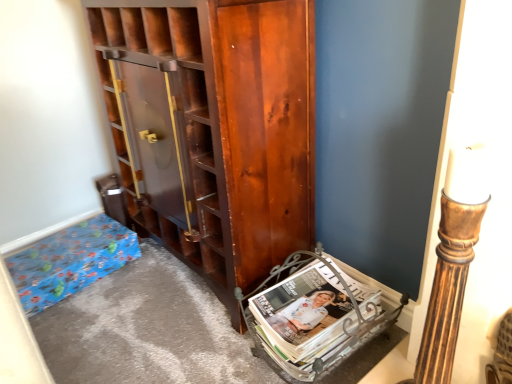
Question: Is blue paper bag at lower left taller than matte metallic magazine rack at lower right?

Choices:
 (A) no
 (B) yes

Answer: (A)

Question: From a real-world perspective, is blue paper bag at lower left physically above matte metallic magazine rack at lower right?

Choices:
 (A) yes
 (B) no

Answer: (B)

Question: Is blue paper bag at lower left wider than matte metallic magazine rack at lower right?

Choices:
 (A) no
 (B) yes

Answer: (A)

Question: Is blue paper bag at lower left far from matte metallic magazine rack at lower right?

Choices:
 (A) no
 (B) yes

Answer: (A)

Question: Can you confirm if blue paper bag at lower left is positioned to the left of matte metallic magazine rack at lower right?

Choices:
 (A) yes
 (B) no

Answer: (A)

Question: Considering the relative sizes of blue paper bag at lower left and matte metallic magazine rack at lower right in the image provided, is blue paper bag at lower left thinner than matte metallic magazine rack at lower right?

Choices:
 (A) yes
 (B) no

Answer: (A)

Question: Considering the relative positions of matte metallic magazine rack at lower right and blue paper bag at lower left in the image provided, is matte metallic magazine rack at lower right to the right of blue paper bag at lower left from the viewer's perspective?

Choices:
 (A) no
 (B) yes

Answer: (B)

Question: Is matte metallic magazine rack at lower right not inside blue paper bag at lower left?

Choices:
 (A) no
 (B) yes

Answer: (B)

Question: Is matte metallic magazine rack at lower right positioned before blue paper bag at lower left?

Choices:
 (A) no
 (B) yes

Answer: (B)

Question: From the image's perspective, is matte metallic magazine rack at lower right on top of blue paper bag at lower left?

Choices:
 (A) yes
 (B) no

Answer: (B)

Question: Considering the relative sizes of matte metallic magazine rack at lower right and blue paper bag at lower left in the image provided, is matte metallic magazine rack at lower right smaller than blue paper bag at lower left?

Choices:
 (A) no
 (B) yes

Answer: (B)

Question: Is matte metallic magazine rack at lower right shorter than blue paper bag at lower left?

Choices:
 (A) no
 (B) yes

Answer: (A)

Question: Is matte metallic magazine rack at lower right surrounded by shiny brown cabinet at center?

Choices:
 (A) yes
 (B) no

Answer: (B)